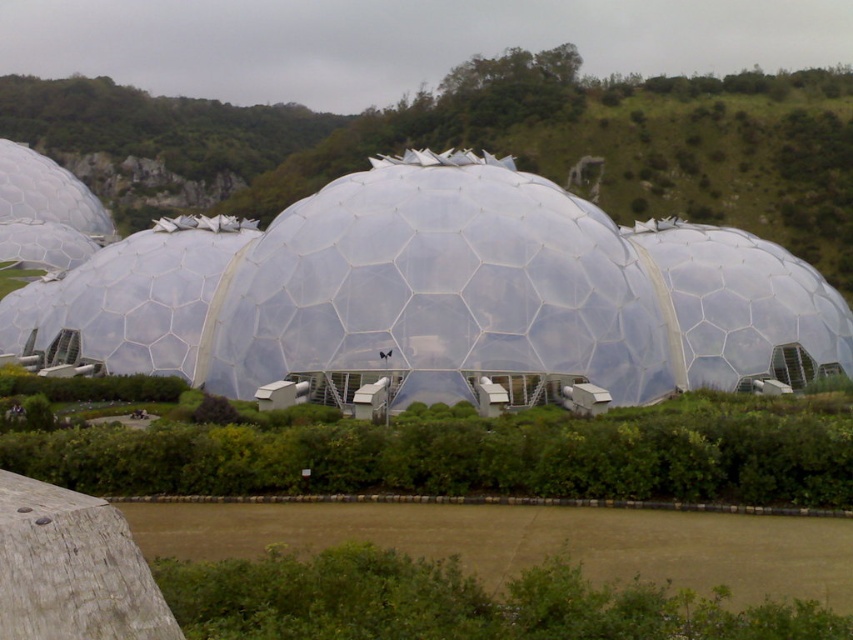
Is transparent glass dome at center to the left of green grassy hillside at upper center from the viewer's perspective?

In fact, transparent glass dome at center is to the right of green grassy hillside at upper center.

Which is in front, point (431, 388) or point (726, 221)?

Point (431, 388) is more forward.

At what (x,y) coordinates should I click in order to perform the action: click on transparent glass dome at center. Please return your answer as a coordinate pair (x, y). The image size is (853, 640). Looking at the image, I should click on (439, 292).